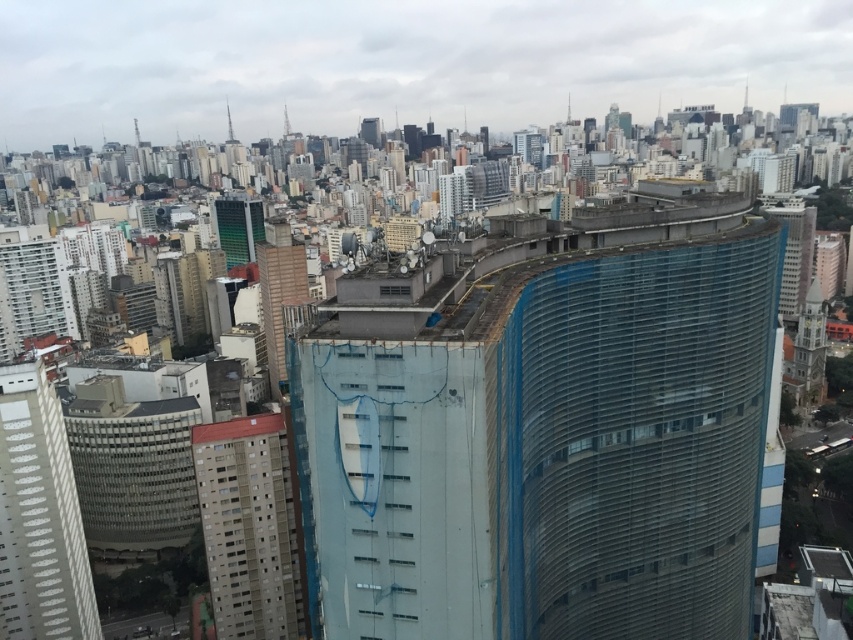
Between point (61, 474) and point (254, 260), which one is positioned behind?

The point (254, 260) is more distant.

Identify the location of white textured building at lower left. The image size is (853, 640). (39, 516).

Can you confirm if transparent glass tower at center is positioned to the left of white textured building at lower left?

Incorrect, transparent glass tower at center is not on the left side of white textured building at lower left.

Looking at this image, does transparent glass tower at center have a lesser width compared to white textured building at lower left?

No, transparent glass tower at center is not thinner than white textured building at lower left.

Locate an element on the screen. The width and height of the screenshot is (853, 640). transparent glass tower at center is located at coordinates (543, 429).

Consider the image. Does white textured building at lower left appear on the left side of gray concrete building at center-left?

Yes, white textured building at lower left is to the left of gray concrete building at center-left.

Is white textured building at lower left to the right of gray concrete building at center-left from the viewer's perspective?

No, white textured building at lower left is not to the right of gray concrete building at center-left.

Find the location of a particular element. white textured building at lower left is located at coordinates (39, 516).

Locate an element on the screen. The image size is (853, 640). white textured building at lower left is located at coordinates (39, 516).